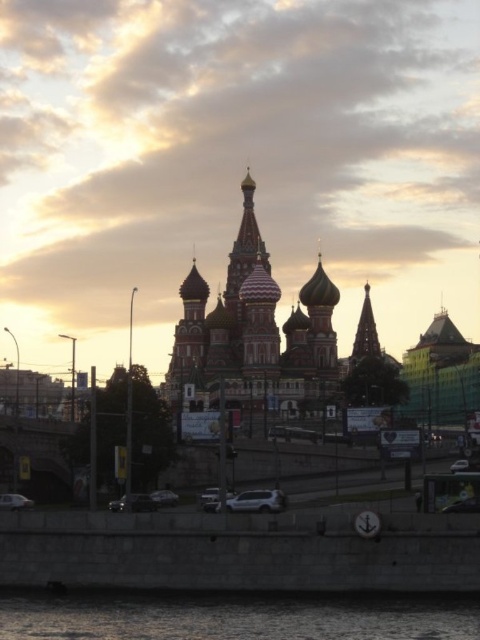
What are the coordinates of `red brick church at center` in the screenshot? It's located at (253, 336).

Which is behind, point (276, 355) or point (169, 596)?

The point (276, 355) is behind.

Where is `red brick church at center`? red brick church at center is located at coordinates (253, 336).